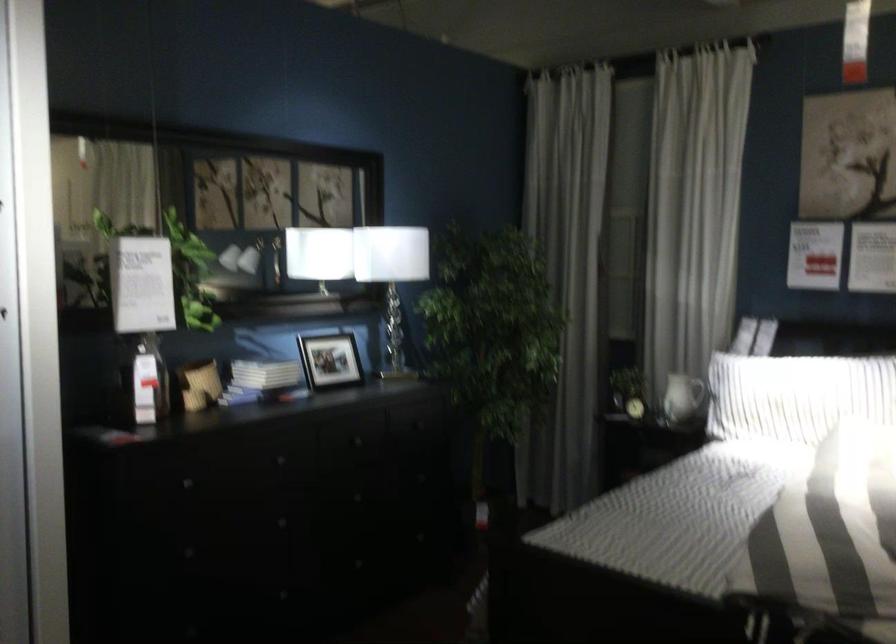
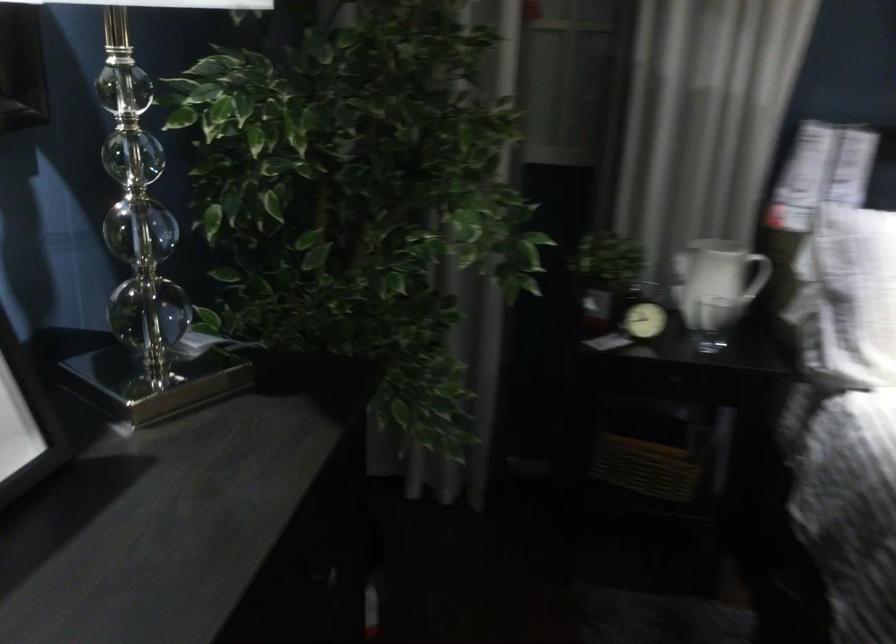
Locate, in the second image, the point that corresponds to (x=648, y=480) in the first image.

(645, 467)